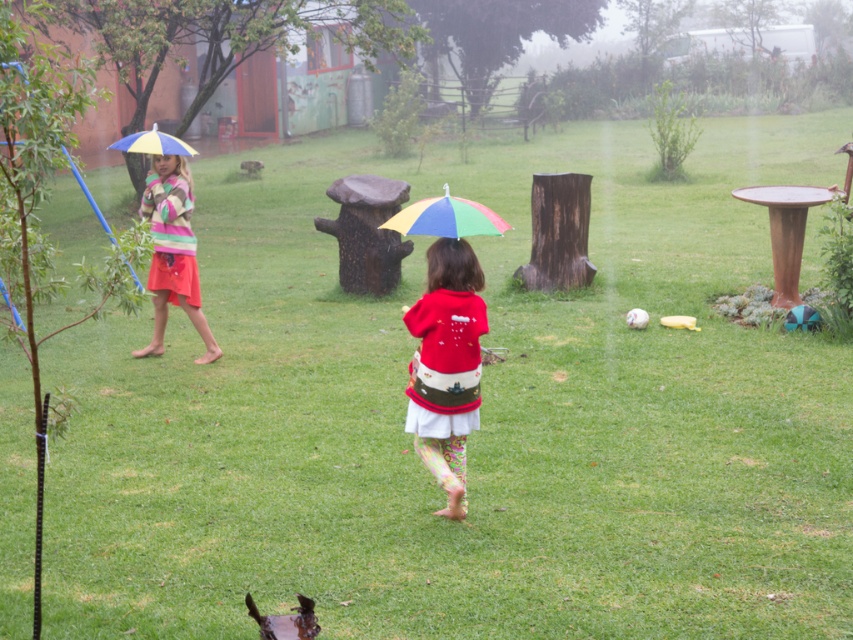
You are standing in the garden and want to place a new flower pot between the two points marked as point (396, 221) and point (125, 147). Which point should the flower pot be closer to if it needs to be placed closer to the viewer?

The flower pot should be placed closer to point (396, 221) because it is closer to the viewer than point (125, 147).

You are a photographer trying to capture both the matte red sweater at center and the rainbow fabric umbrella at center in a single shot. Since you can only focus on one object at a time, which one should you choose to ensure the other remains in the background?

You should focus on the matte red sweater at center because it is closer to you than the rainbow fabric umbrella at center, so the umbrella will naturally appear in the background.